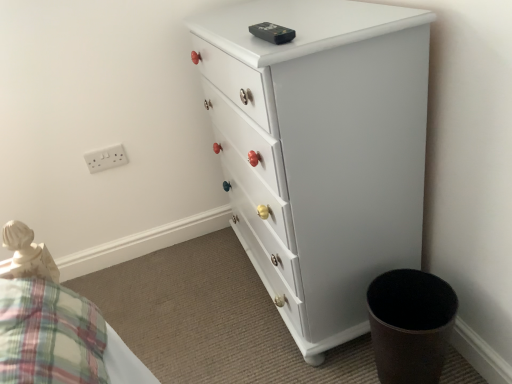
Question: Could white plastic outlet at upper left be considered to be inside white painted wood chest of drawers at center?

Choices:
 (A) yes
 (B) no

Answer: (B)

Question: Can you confirm if white painted wood chest of drawers at center is bigger than white plastic outlet at upper left?

Choices:
 (A) yes
 (B) no

Answer: (A)

Question: Can you confirm if white painted wood chest of drawers at center is shorter than white plastic outlet at upper left?

Choices:
 (A) no
 (B) yes

Answer: (A)

Question: Is white painted wood chest of drawers at center directly adjacent to white plastic outlet at upper left?

Choices:
 (A) yes
 (B) no

Answer: (B)

Question: Is white painted wood chest of drawers at center wider than white plastic outlet at upper left?

Choices:
 (A) no
 (B) yes

Answer: (B)

Question: Considering the relative positions of white painted wood chest of drawers at center and white plastic outlet at upper left in the image provided, is white painted wood chest of drawers at center to the left of white plastic outlet at upper left from the viewer's perspective?

Choices:
 (A) no
 (B) yes

Answer: (A)

Question: From the image's perspective, is white plastic outlet at upper left under white painted wood chest of drawers at center?

Choices:
 (A) no
 (B) yes

Answer: (A)

Question: Does white plastic outlet at upper left have a greater height compared to white painted wood chest of drawers at center?

Choices:
 (A) yes
 (B) no

Answer: (B)

Question: Is white plastic outlet at upper left smaller than white painted wood chest of drawers at center?

Choices:
 (A) no
 (B) yes

Answer: (B)

Question: Is white plastic outlet at upper left in contact with white painted wood chest of drawers at center?

Choices:
 (A) yes
 (B) no

Answer: (B)

Question: Is white plastic outlet at upper left aimed at white painted wood chest of drawers at center?

Choices:
 (A) yes
 (B) no

Answer: (B)

Question: Is white plastic outlet at upper left further to the viewer compared to white painted wood chest of drawers at center?

Choices:
 (A) no
 (B) yes

Answer: (B)

Question: From a real-world perspective, is white painted wood chest of drawers at center physically located above or below white plastic outlet at upper left?

Choices:
 (A) below
 (B) above

Answer: (A)